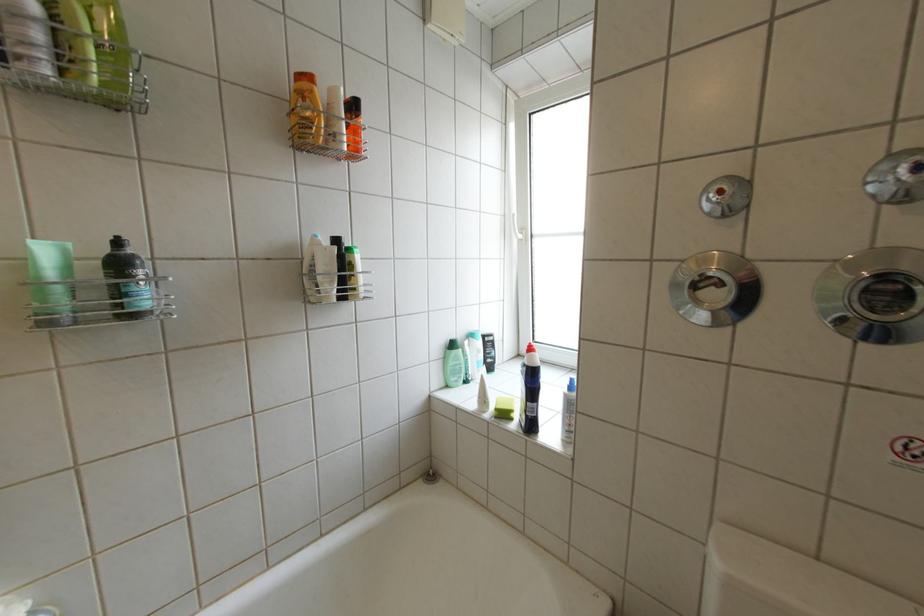
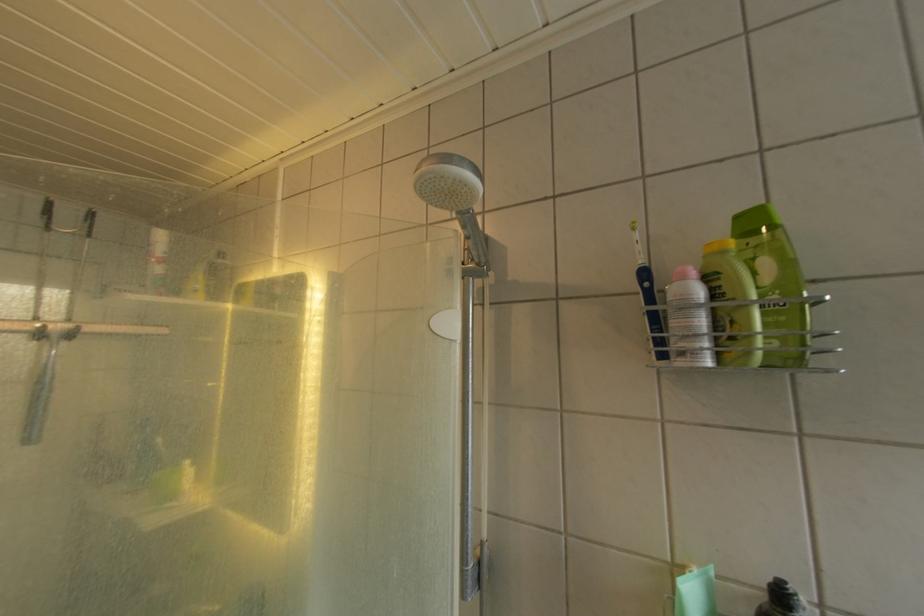
Find the pixel in the second image that matches pixel 99 63 in the first image.

(763, 338)